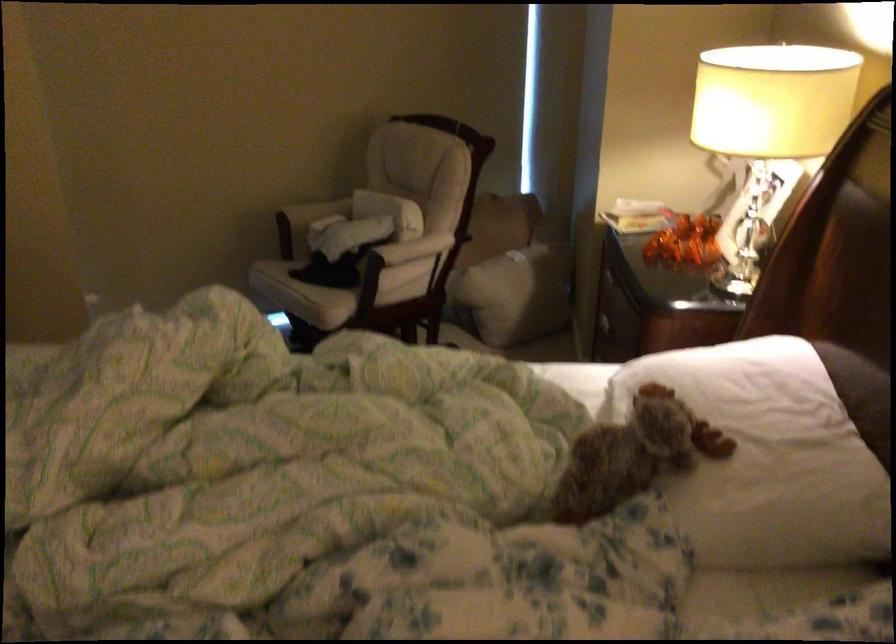
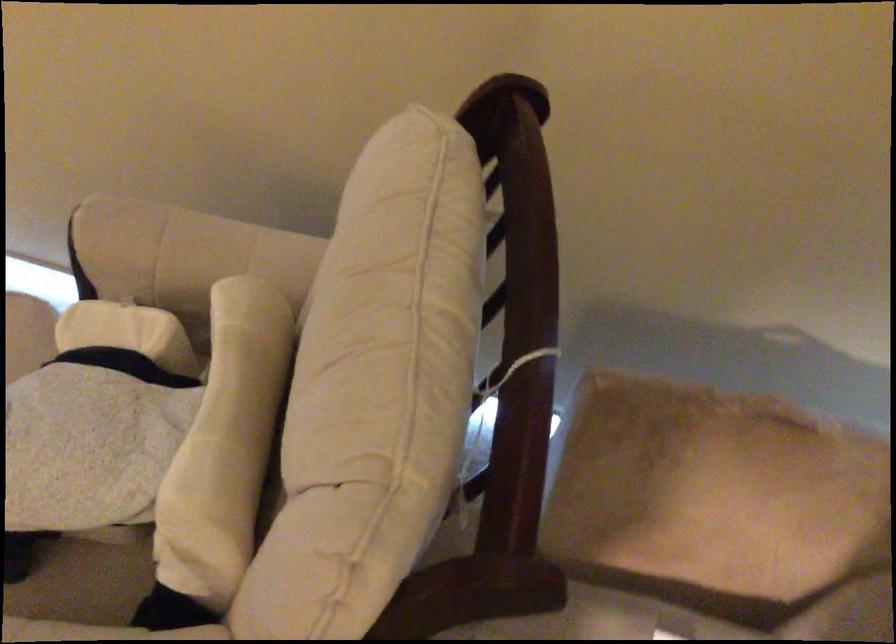
In the second image, find the point that corresponds to the point at 401,192 in the first image.

(225, 444)